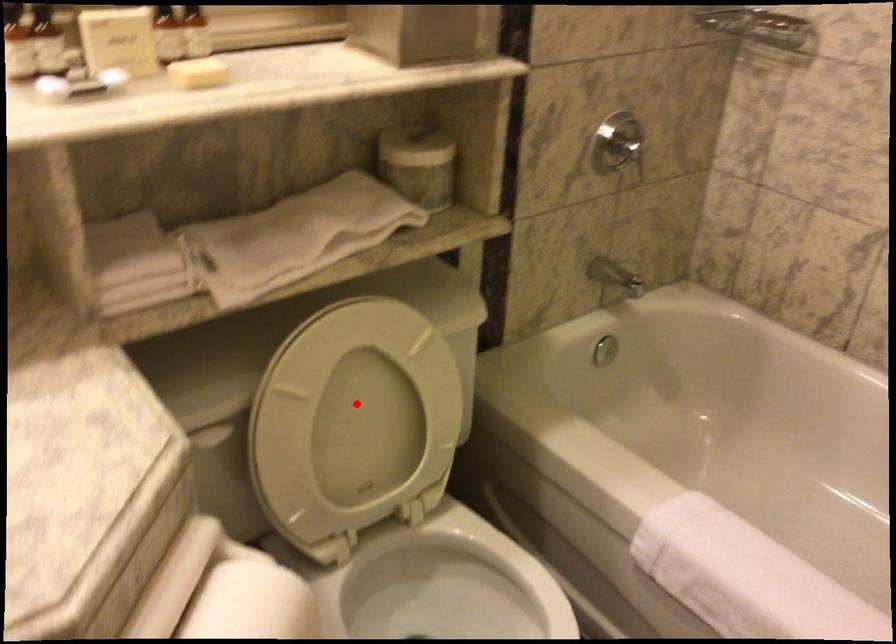
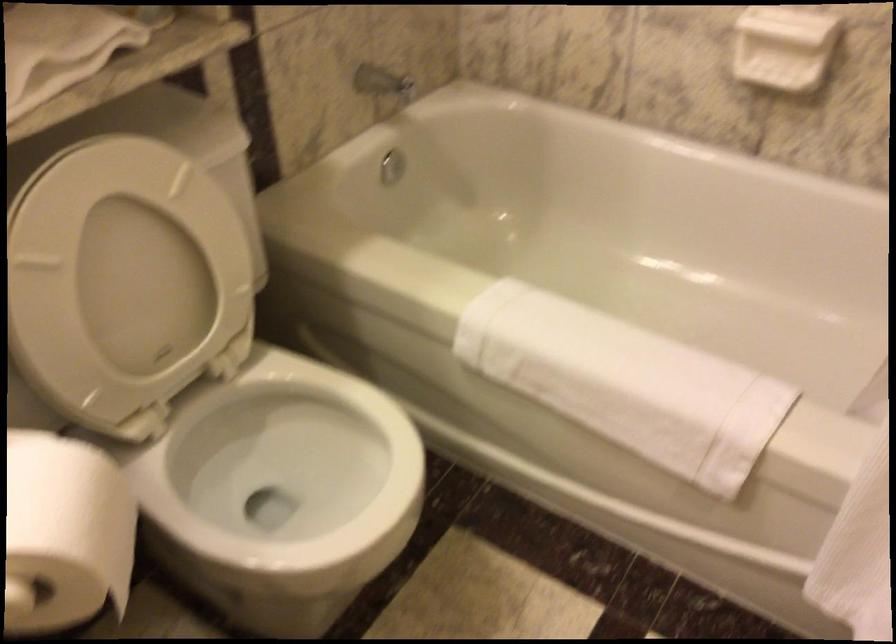
In the second image, find the point that corresponds to the highlighted location in the first image.

(126, 266)